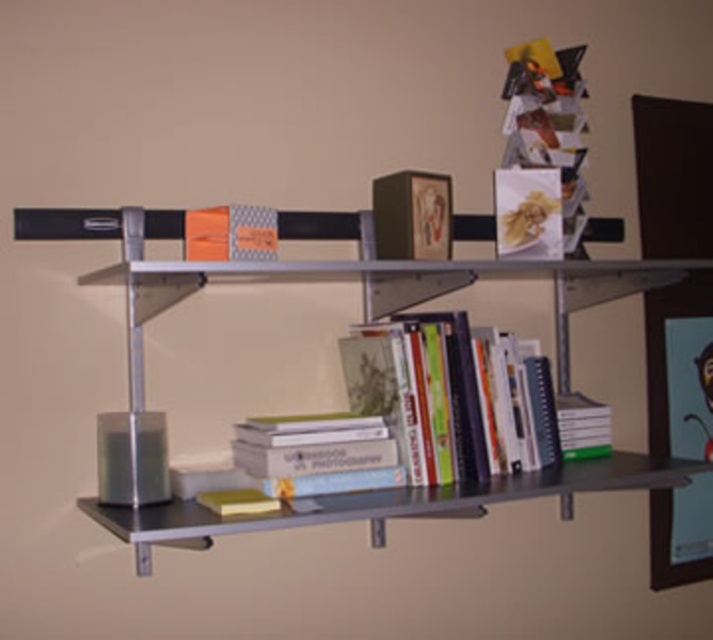
Based on the photo, how much distance is there between hardcover books at center and matte paper magazine at upper right?

hardcover books at center and matte paper magazine at upper right are 18.48 inches apart.

Describe the element at coordinates (453, 396) in the screenshot. I see `hardcover books at center` at that location.

Find the location of a particular element. hardcover books at center is located at coordinates (453, 396).

Does hardcover books at center appear on the right side of hardcover book at center?

No, hardcover books at center is not to the right of hardcover book at center.

Between point (461, 401) and point (595, 410), which one is positioned behind?

The point (595, 410) is behind.

Measure the distance between point (374,387) and camera.

Point (374,387) is 4.82 feet from camera.

The width and height of the screenshot is (713, 640). What are the coordinates of `hardcover books at center` in the screenshot? It's located at (453, 396).

Who is positioned more to the left, matte paper magazine at upper right or yellow matte book at lower center?

Positioned to the left is yellow matte book at lower center.

Locate an element on the screen. The image size is (713, 640). matte paper magazine at upper right is located at coordinates (548, 124).